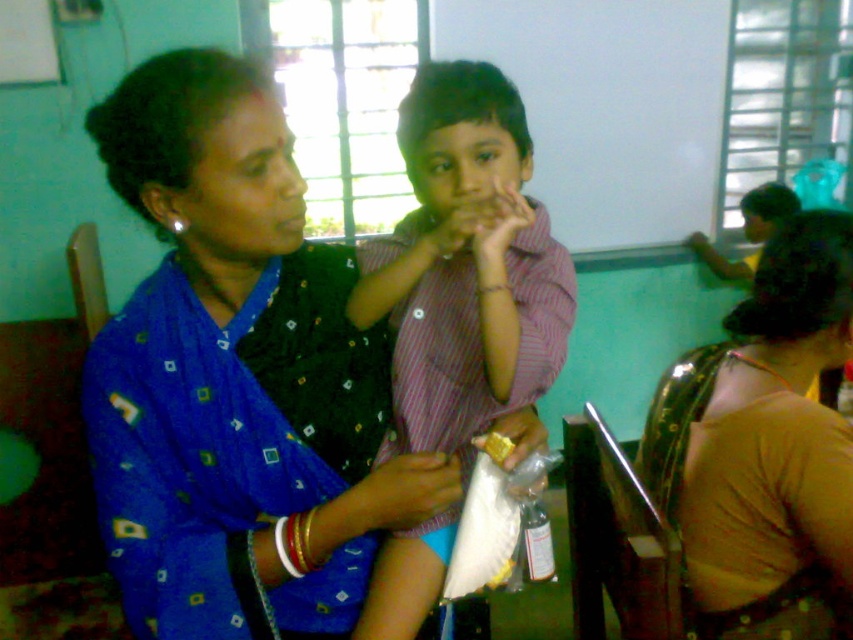
Question: From the image, what is the correct spatial relationship of striped cotton shirt at center in relation to yellow matte snack at center?

Choices:
 (A) right
 (B) left

Answer: (B)

Question: From the image, what is the correct spatial relationship of blue printed sari at center in relation to yellow matte snack at center?

Choices:
 (A) right
 (B) left

Answer: (B)

Question: Among these points, which one is farthest from the camera?

Choices:
 (A) (512, 323)
 (B) (286, 582)

Answer: (A)

Question: Estimate the real-world distances between objects in this image. Which object is farther from the yellow matte snack at center?

Choices:
 (A) brown fabric sari at lower right
 (B) blue printed sari at center

Answer: (A)

Question: Can you confirm if striped cotton shirt at center is thinner than yellow matte snack at center?

Choices:
 (A) no
 (B) yes

Answer: (A)

Question: Which point is closer to the camera?

Choices:
 (A) brown fabric sari at lower right
 (B) blue printed sari at center

Answer: (B)